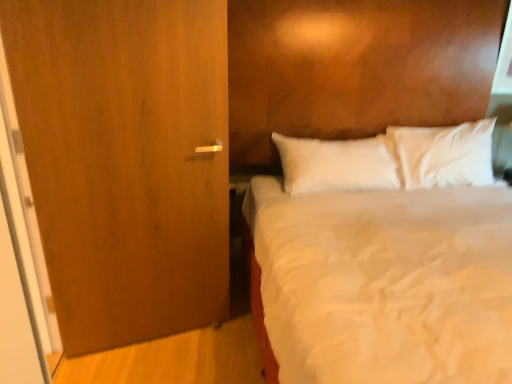
This screenshot has height=384, width=512. What do you see at coordinates (125, 161) in the screenshot?
I see `wooden door at left` at bounding box center [125, 161].

Locate an element on the screen. The width and height of the screenshot is (512, 384). wooden door at left is located at coordinates (125, 161).

Identify the location of wooden door at left. The height and width of the screenshot is (384, 512). (125, 161).